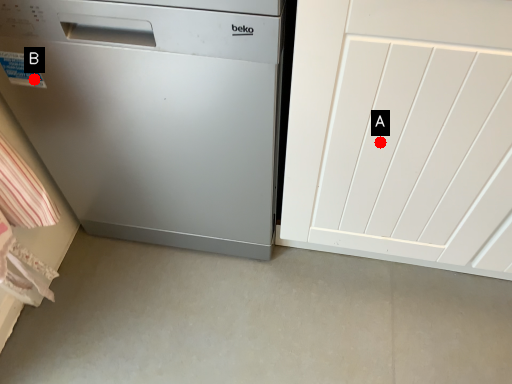
Question: Two points are circled on the image, labeled by A and B beside each circle. Which point is further to the camera?

Choices:
 (A) A is further
 (B) B is further

Answer: (B)